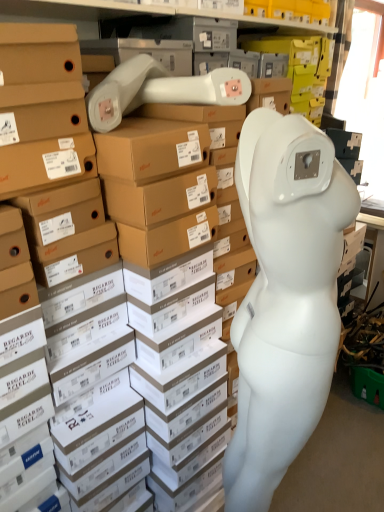
Question: Is white matte mannequin at right taller or shorter than white matte mannequin head at center?

Choices:
 (A) short
 (B) tall

Answer: (B)

Question: Choose the correct answer: Is white matte mannequin at right inside white matte mannequin head at center or outside it?

Choices:
 (A) outside
 (B) inside

Answer: (A)

Question: From the image's perspective, is white matte mannequin at right positioned above or below white matte mannequin head at center?

Choices:
 (A) above
 (B) below

Answer: (B)

Question: Would you say white matte mannequin head at center is to the left or to the right of white matte mannequin at right in the picture?

Choices:
 (A) left
 (B) right

Answer: (B)

Question: Considering the positions of white matte mannequin head at center and white matte mannequin at right in the image, is white matte mannequin head at center wider or thinner than white matte mannequin at right?

Choices:
 (A) thin
 (B) wide

Answer: (B)

Question: Relative to white matte mannequin at right, is white matte mannequin head at center in front or behind?

Choices:
 (A) front
 (B) behind

Answer: (B)

Question: Looking at the image, does white matte mannequin head at center seem bigger or smaller compared to white matte mannequin at right?

Choices:
 (A) big
 (B) small

Answer: (B)